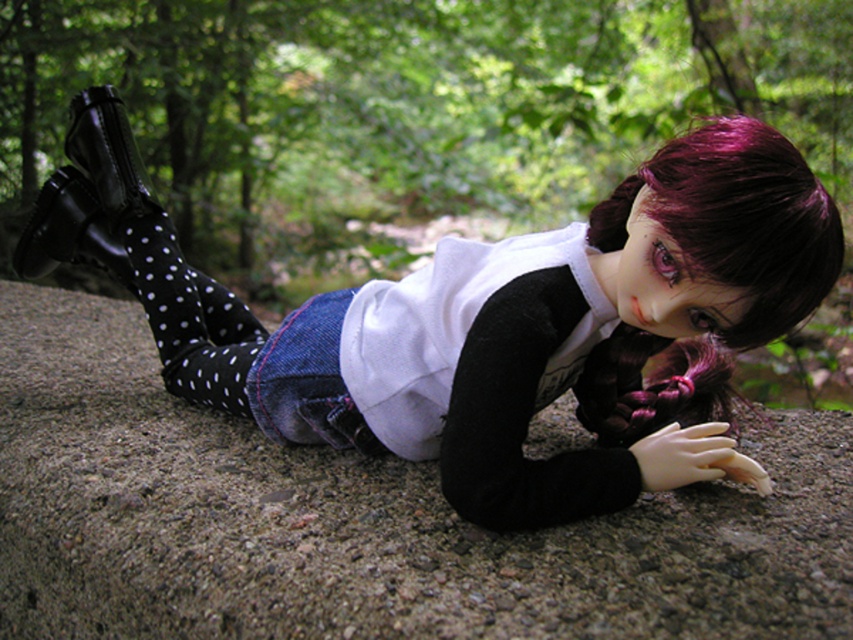
Question: Which point is farther from the camera taking this photo?

Choices:
 (A) (763, 205)
 (B) (102, 636)

Answer: (B)

Question: In this image, where is gray concrete at center located relative to white matte shirt at center?

Choices:
 (A) left
 (B) right

Answer: (A)

Question: Is gray concrete at center positioned before white matte shirt at center?

Choices:
 (A) yes
 (B) no

Answer: (A)

Question: Is gray concrete at center thinner than white matte shirt at center?

Choices:
 (A) yes
 (B) no

Answer: (B)